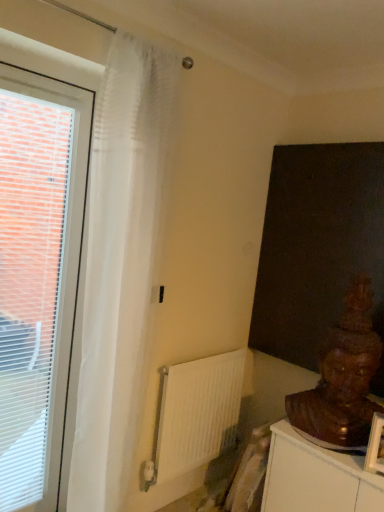
Question: Is white plastic window at left wider than brown wooden statue at lower right?

Choices:
 (A) no
 (B) yes

Answer: (A)

Question: Is brown wooden statue at lower right completely or partially inside white plastic window at left?

Choices:
 (A) no
 (B) yes

Answer: (A)

Question: Does white plastic window at left lie in front of brown wooden statue at lower right?

Choices:
 (A) no
 (B) yes

Answer: (B)

Question: From a real-world perspective, is white plastic window at left below brown wooden statue at lower right?

Choices:
 (A) yes
 (B) no

Answer: (B)

Question: Is white plastic window at left taller than brown wooden statue at lower right?

Choices:
 (A) no
 (B) yes

Answer: (B)

Question: From the image's perspective, is white plastic window at left located beneath brown wooden statue at lower right?

Choices:
 (A) yes
 (B) no

Answer: (B)

Question: Is white matte radiator at center behind brown wooden statue at lower right?

Choices:
 (A) no
 (B) yes

Answer: (B)

Question: Does white matte radiator at center have a greater width compared to brown wooden statue at lower right?

Choices:
 (A) no
 (B) yes

Answer: (A)

Question: Is white matte radiator at center not close to brown wooden statue at lower right?

Choices:
 (A) no
 (B) yes

Answer: (A)

Question: Considering the relative sizes of white matte radiator at center and brown wooden statue at lower right in the image provided, is white matte radiator at center thinner than brown wooden statue at lower right?

Choices:
 (A) no
 (B) yes

Answer: (B)

Question: Is white matte radiator at center in front of brown wooden statue at lower right?

Choices:
 (A) no
 (B) yes

Answer: (A)

Question: From the image's perspective, is white matte radiator at center under brown wooden statue at lower right?

Choices:
 (A) no
 (B) yes

Answer: (B)

Question: Can white plastic window at left be found inside white matte radiator at center?

Choices:
 (A) no
 (B) yes

Answer: (A)